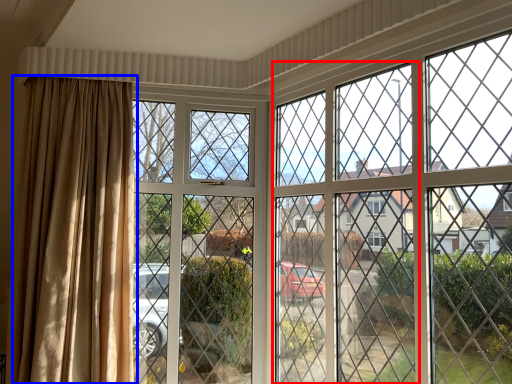
Question: Which of the following is the closest to the observer, screen door (highlighted by a red box) or curtain (highlighted by a blue box)?

Choices:
 (A) screen door
 (B) curtain

Answer: (A)